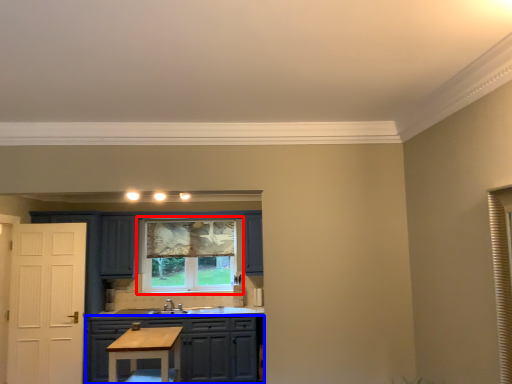
Question: Which object is closer to the camera taking this photo, window (highlighted by a red box) or cabinetry (highlighted by a blue box)?

Choices:
 (A) window
 (B) cabinetry

Answer: (B)